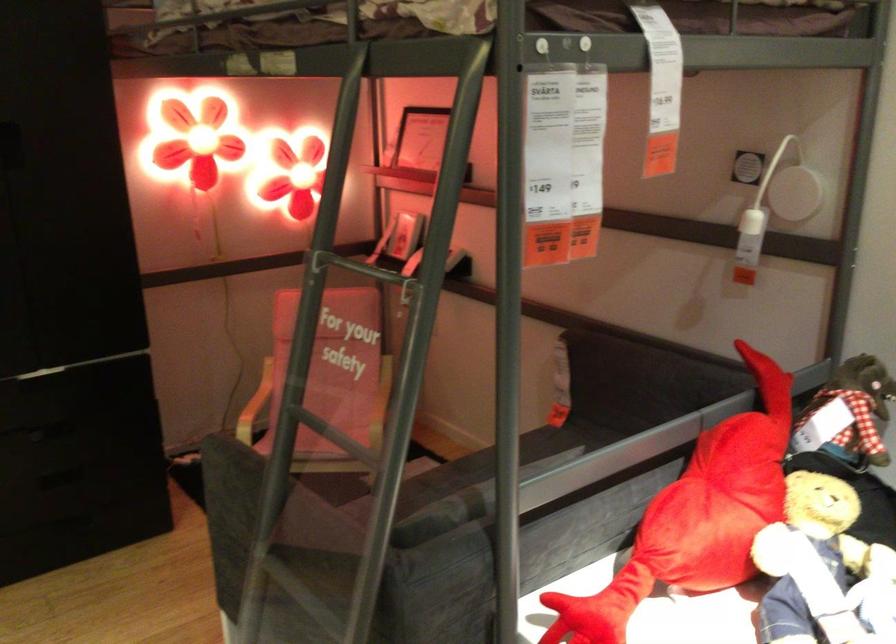
Identify the location of pink chair sitting surface. Image resolution: width=896 pixels, height=644 pixels. (331, 404).